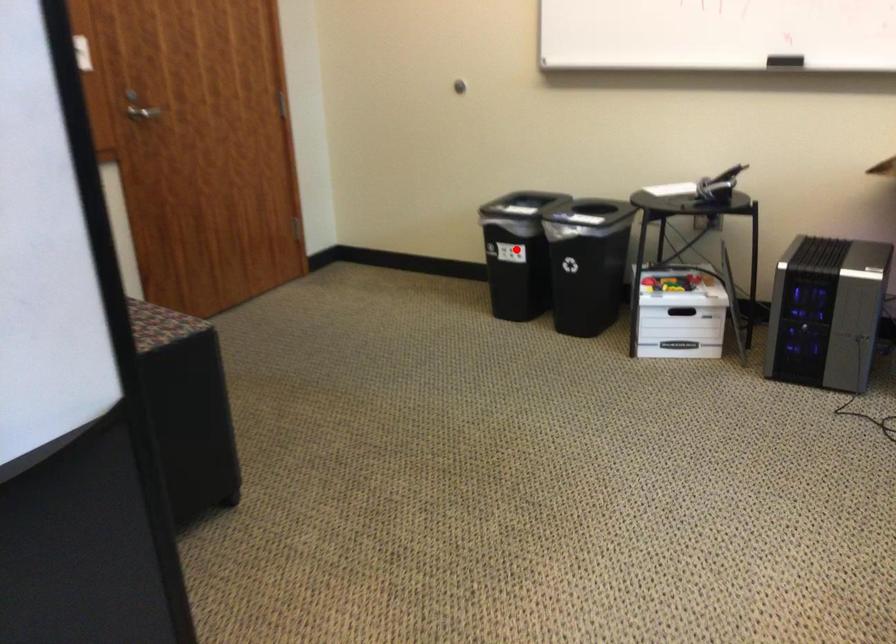
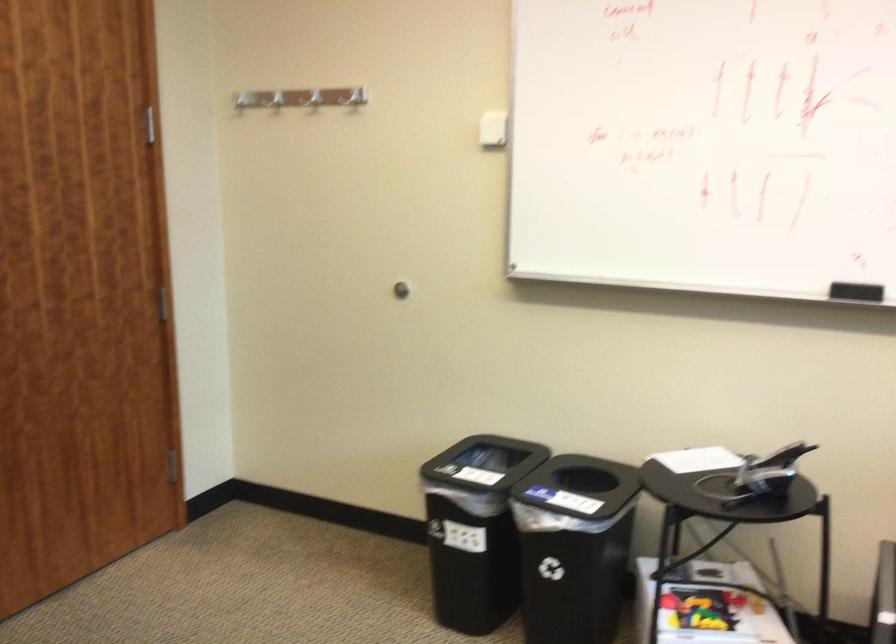
Locate, in the second image, the point that corresponds to the highlighted location in the first image.

(475, 529)